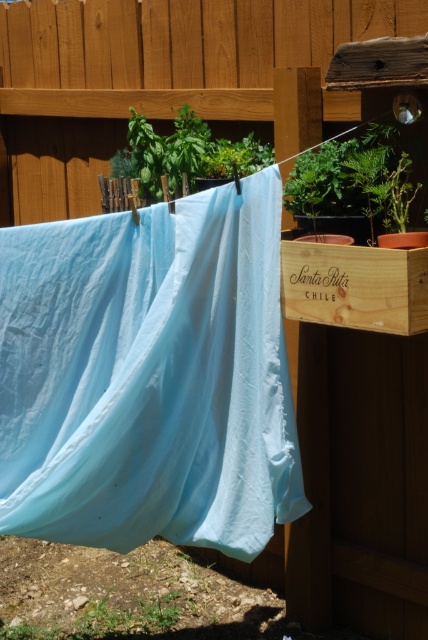
Which of these two, light blue fabric at center or green leafy plant at upper center, stands taller?

light blue fabric at center

Who is more distant from viewer, (157, 268) or (172, 189)?

Point (172, 189)

Which is behind, point (272, 424) or point (180, 150)?

Positioned behind is point (180, 150).

What are the coordinates of `light blue fabric at center` in the screenshot? It's located at (148, 376).

Can you confirm if green leafy plant at upper right is smaller than green leafy plant at upper center?

Indeed, green leafy plant at upper right has a smaller size compared to green leafy plant at upper center.

Does green leafy plant at upper right have a lesser width compared to green leafy plant at upper center?

Yes.

I want to click on green leafy plant at upper right, so click(348, 179).

Can you confirm if wooden at upper center is positioned above green leafy plant at upper right?

Yes.

Is point (26, 29) farther from viewer compared to point (389, 129)?

Yes, point (26, 29) is farther from viewer.

You are a GUI agent. You are given a task and a screenshot of the screen. Output one action in this format:
    pyautogui.click(x=<x>, y=<y>)
    Task: Click on the wooden at upper center
    The image size is (428, 640).
    Given the screenshot: What is the action you would take?
    pyautogui.click(x=152, y=74)